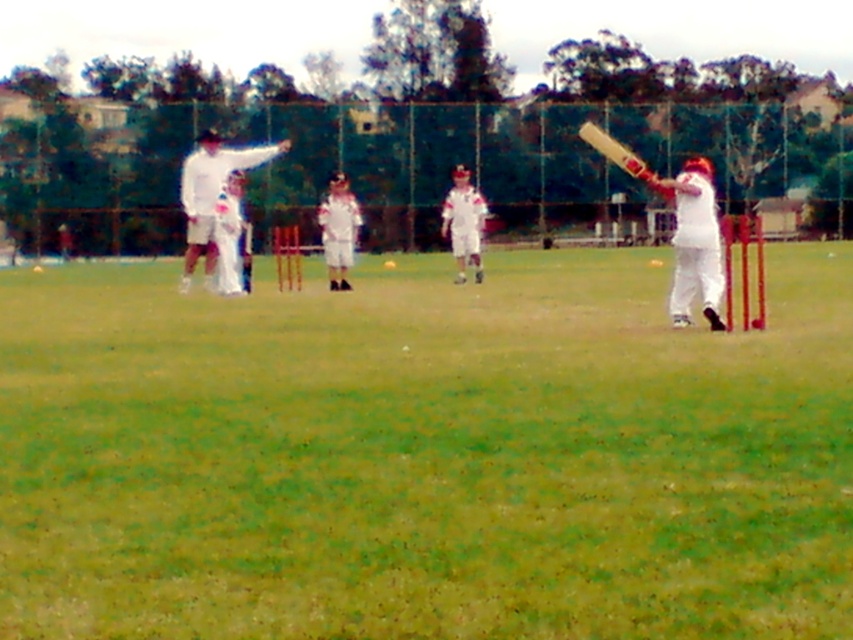
You are a photographer standing at the edge of the cricket field. You want to take a photo that includes both the green grass at center and the white matte cricket bat at center. Which object should you focus on first if you want to capture the larger one in your frame?

The green grass at center is bigger than the white matte cricket bat at center, so you should focus on the green grass at center first to capture the larger object in your frame.

You are a spectator at the cricket match and want to take a photo of both the white matte cricket bat at center and the white cloth cricket bat at center. Which one is closer to the camera so that it appears larger in your photo?

The white matte cricket bat at center is closer to the camera because the white cloth cricket bat at center is behind it, making the white matte cricket bat appear larger in the photo.